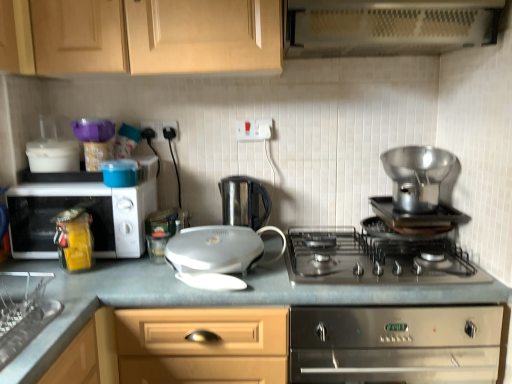
Question: Considering the positions of metallic perforated exhaust hood at upper center and stainless steel gas stove at center in the image, is metallic perforated exhaust hood at upper center wider or thinner than stainless steel gas stove at center?

Choices:
 (A) wide
 (B) thin

Answer: (B)

Question: From the image's perspective, relative to stainless steel gas stove at center, is metallic perforated exhaust hood at upper center above or below?

Choices:
 (A) above
 (B) below

Answer: (A)

Question: Based on their relative distances, which object is nearer to the yellow plastic container at left?

Choices:
 (A) white glossy electric grill at center
 (B) stainless steel gas stove at center
 (C) white plastic electric outlet at upper center, which is the first electric outlet in left-to-right order
 (D) matte wood cabinets at upper center
 (E) white glossy sandwich maker at center, which ranks as the 1th kitchen appliance in left-to-right order

Answer: (A)

Question: Which of these objects is positioned closest to the metallic perforated exhaust hood at upper center?

Choices:
 (A) yellow plastic container at left
 (B) shiny metallic pot at right, the third kitchen appliance from the left
 (C) stainless steel gas stove at center
 (D) matte wood cabinets at upper center
 (E) white plastic electrical outlet at upper center, which is the first electric outlet from right to left

Answer: (D)